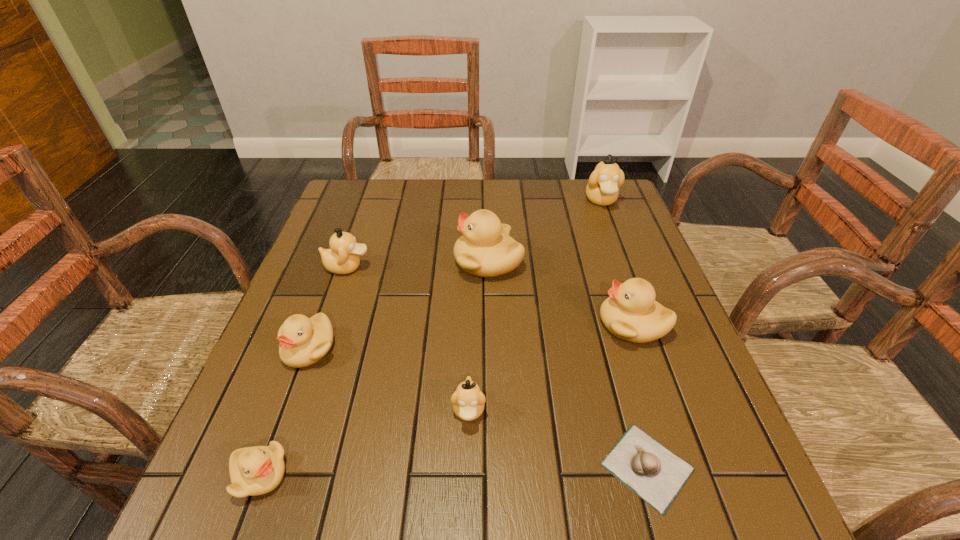
Where is `free spot between the rightmost yellow duckling and the leftmost tan duckling`? free spot between the rightmost yellow duckling and the leftmost tan duckling is located at coordinates (491, 295).

Where is `empty space between the leftmost tan duckling and the second yellow duckling from right to left`? This screenshot has height=540, width=960. empty space between the leftmost tan duckling and the second yellow duckling from right to left is located at coordinates (418, 264).

Locate an element on the screen. This screenshot has width=960, height=540. free point between the smallest yellow duckling and the rightmost yellow duckling is located at coordinates point(446,400).

Identify the location of unoccupied area between the smallest tan duckling and the second smallest tan duckling. (408, 339).

I want to click on free spot between the third biggest yellow duckling and the farthest duckling, so click(455, 274).

Identify the location of free area in between the biggest yellow duckling and the second tan duckling from right to left. Image resolution: width=960 pixels, height=540 pixels. (478, 336).

Locate an element on the screen. The height and width of the screenshot is (540, 960). vacant space that is in between the farthest tan duckling and the farthest yellow duckling is located at coordinates [545, 231].

The height and width of the screenshot is (540, 960). In order to click on object that is the seventh nearest to the shortest duckling in this screenshot , I will do `click(602, 189)`.

Locate which object is the second closest to the second smallest yellow duckling. Please provide its 2D coordinates. Your answer should be formatted as a tuple, i.e. [(x, y)], where the tuple contains the x and y coordinates of a point satisfying the conditions above.

[(257, 470)]

Where is `duckling object that ranks as the fourth closest to the garlic`? duckling object that ranks as the fourth closest to the garlic is located at coordinates (303, 341).